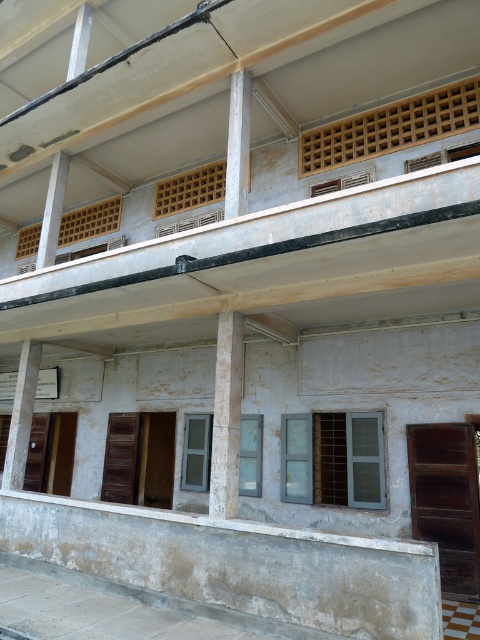
You are standing in front of the building and want to locate the wooden lattice at upper center. According to the coordinates provided, where should you look relative to the building?

The wooden lattice at upper center is located at coordinates 0.200 on the x axis and 0.817 on the y axis, so you should look to the left side near the top of the building.

You are a maintenance worker assessing the building structure. You notice two white concrete pillars supporting the roof. Which pillar, the white concrete pillar at center or the white concrete pillar at lower left, is shorter?

The white concrete pillar at center is shorter than the white concrete pillar at lower left.

You are a painter standing on the ground floor of the building. You need to paint both the wooden lattice at upper center and the white concrete column at center. Which object will require you to climb higher to reach?

The white concrete column at center is taller than the wooden lattice at upper center, so you will need to climb higher to reach the white concrete column at center.